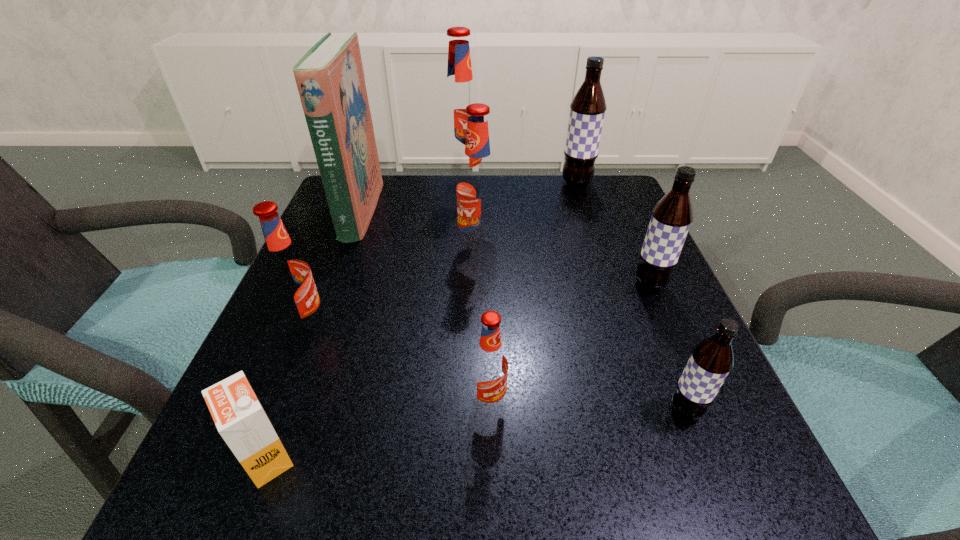
In order to click on blank space located 0.270m on the back of the nearest red root beer in this screenshot , I will do `click(487, 272)`.

Find the location of a particular element. The width and height of the screenshot is (960, 540). free space located on the left of the nearest brown root beer is located at coordinates (612, 410).

Locate an element on the screen. This screenshot has height=540, width=960. vacant space located 0.070m on the back of the orange orange juice is located at coordinates (293, 388).

Where is `hardback book situated at the far edge`? hardback book situated at the far edge is located at coordinates (330, 79).

Locate an element on the screen. object that is at the near edge is located at coordinates (237, 413).

Where is `hardback book at the left edge`? Image resolution: width=960 pixels, height=540 pixels. hardback book at the left edge is located at coordinates (330, 79).

Identify the location of root beer that is at the left edge. The width and height of the screenshot is (960, 540). (288, 274).

The height and width of the screenshot is (540, 960). I want to click on orange juice present at the left edge, so click(x=237, y=413).

I want to click on object present at the far left corner, so click(330, 79).

This screenshot has width=960, height=540. Find the location of `object that is at the near left corner`. object that is at the near left corner is located at coordinates (237, 413).